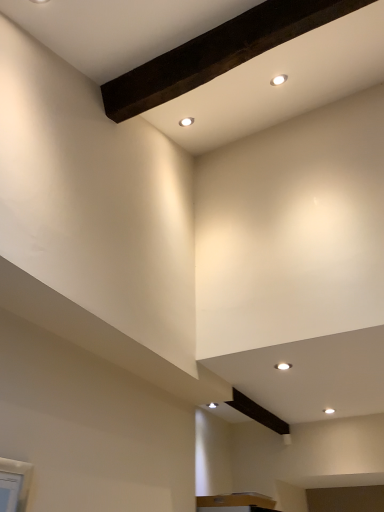
Identify the location of matte brown cabinet at lower center. The image size is (384, 512). (235, 502).

Consider the image. Measure the distance between matte brown cabinet at lower center and camera.

The distance of matte brown cabinet at lower center from camera is 2.42 meters.

Describe the element at coordinates (235, 502) in the screenshot. I see `matte brown cabinet at lower center` at that location.

The width and height of the screenshot is (384, 512). What are the coordinates of `matte brown cabinet at lower center` in the screenshot? It's located at (235, 502).